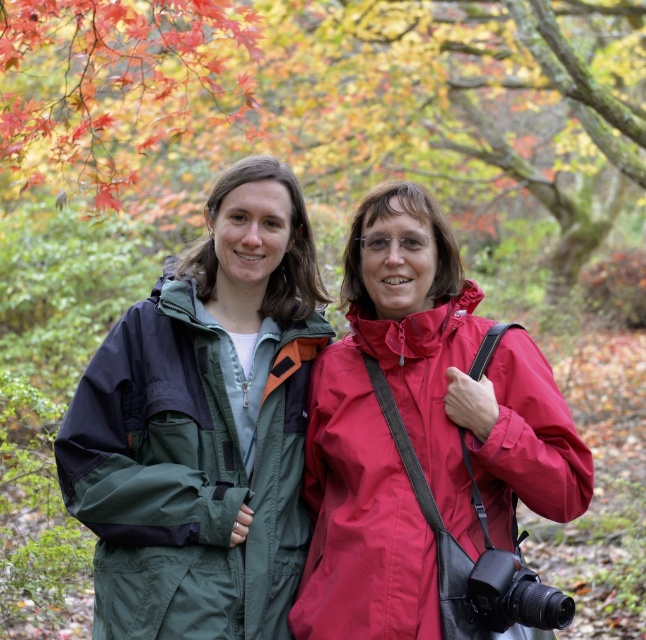
Question: Can you confirm if matte red jacket at center is positioned below green fabric jacket at center?

Choices:
 (A) no
 (B) yes

Answer: (A)

Question: Which point appears closest to the camera in this image?

Choices:
 (A) (193, 413)
 (B) (348, 310)

Answer: (A)

Question: Which of the following is the closest to the observer?

Choices:
 (A) (247, 552)
 (B) (333, 388)

Answer: (A)

Question: Is matte red jacket at center above green fabric jacket at center?

Choices:
 (A) yes
 (B) no

Answer: (A)

Question: Among these objects, which one is nearest to the camera?

Choices:
 (A) matte red jacket at center
 (B) green fabric jacket at center

Answer: (A)

Question: Is matte red jacket at center to the right of green fabric jacket at center from the viewer's perspective?

Choices:
 (A) no
 (B) yes

Answer: (B)